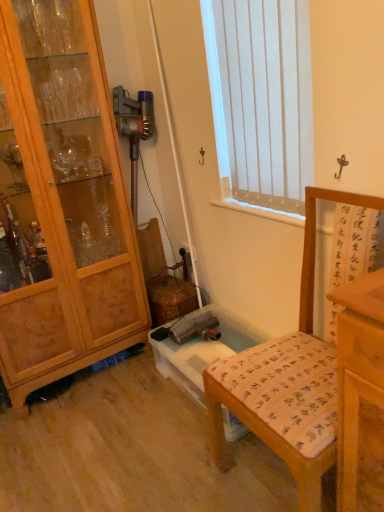
The image size is (384, 512). What do you see at coordinates (287, 382) in the screenshot?
I see `wooden chair with printed cushion at lower right` at bounding box center [287, 382].

Describe the element at coordinates (262, 100) in the screenshot. Image resolution: width=384 pixels, height=512 pixels. I see `white vertical blinds at upper center` at that location.

Find the location of `wooden chair with printed cushion at lower right`. wooden chair with printed cushion at lower right is located at coordinates click(x=287, y=382).

From the image's perspective, which one is positioned lower, wooden chair with printed cushion at lower right or wooden cabinet at left?

wooden chair with printed cushion at lower right appears lower in the image.

Between wooden chair with printed cushion at lower right and wooden cabinet at left, which one has larger size?

Bigger between the two is wooden cabinet at left.

Is wooden chair with printed cushion at lower right looking in the opposite direction of wooden cabinet at left?

wooden chair with printed cushion at lower right is not turned away from wooden cabinet at left.

Find the location of a particular element. This screenshot has height=512, width=384. cabinetry above the wooden chair with printed cushion at lower right (from a real-world perspective) is located at coordinates (64, 198).

Which object is more forward, white vertical blinds at upper center or wooden cabinet at left?

white vertical blinds at upper center is more forward.

Is white vertical blinds at upper center not within wooden cabinet at left?

Yes.

From a real-world perspective, relative to wooden cabinet at left, is white vertical blinds at upper center vertically above or below?

From a real-world perspective, white vertical blinds at upper center is physically above wooden cabinet at left.

Is white vertical blinds at upper center with wooden cabinet at left?

No, white vertical blinds at upper center is not in contact with wooden cabinet at left.

Is wooden cabinet at left wider or thinner than white vertical blinds at upper center?

Considering their sizes, wooden cabinet at left looks broader than white vertical blinds at upper center.

Who is bigger, wooden cabinet at left or white vertical blinds at upper center?

With larger size is wooden cabinet at left.

From a real-world perspective, is wooden cabinet at left located higher than white vertical blinds at upper center?

No, from a real-world perspective, wooden cabinet at left is not over white vertical blinds at upper center

Which object is more forward, wooden cabinet at left or white vertical blinds at upper center?

Positioned in front is white vertical blinds at upper center.

Which is more to the right, wooden chair with printed cushion at lower right or white vertical blinds at upper center?

From the viewer's perspective, wooden chair with printed cushion at lower right appears more on the right side.

From the image's perspective, which object appears higher, wooden chair with printed cushion at lower right or white vertical blinds at upper center?

white vertical blinds at upper center, from the image's perspective.

Considering the sizes of objects wooden chair with printed cushion at lower right and white vertical blinds at upper center in the image provided, who is shorter, wooden chair with printed cushion at lower right or white vertical blinds at upper center?

With less height is white vertical blinds at upper center.

Which of these two, wooden cabinet at left or wooden chair with printed cushion at lower right, stands taller?

Standing taller between the two is wooden cabinet at left.

Considering the relative positions of wooden cabinet at left and wooden chair with printed cushion at lower right in the image provided, is wooden cabinet at left in front of wooden chair with printed cushion at lower right?

No, it is behind wooden chair with printed cushion at lower right.

Which is closer to the camera, (67, 184) or (285, 434)?

The point (285, 434) is in front.

Where is `cabinetry above the wooden chair with printed cushion at lower right (from the image's perspective)`? cabinetry above the wooden chair with printed cushion at lower right (from the image's perspective) is located at coordinates (64, 198).

Considering the relative positions of white vertical blinds at upper center and wooden chair with printed cushion at lower right in the image provided, is white vertical blinds at upper center to the left or to the right of wooden chair with printed cushion at lower right?

Clearly, white vertical blinds at upper center is on the left of wooden chair with printed cushion at lower right in the image.

Would you say white vertical blinds at upper center contains wooden chair with printed cushion at lower right?

No, wooden chair with printed cushion at lower right is located outside of white vertical blinds at upper center.

Can you confirm if white vertical blinds at upper center is shorter than wooden chair with printed cushion at lower right?

Yes, white vertical blinds at upper center is shorter than wooden chair with printed cushion at lower right.

Is white vertical blinds at upper center turned away from wooden chair with printed cushion at lower right?

white vertical blinds at upper center is not turned away from wooden chair with printed cushion at lower right.

The height and width of the screenshot is (512, 384). What are the coordinates of `chair that is in front of the wooden cabinet at left` in the screenshot? It's located at (287, 382).

Find the location of a particular element. This screenshot has height=512, width=384. window above the wooden cabinet at left (from the image's perspective) is located at coordinates (262, 100).

Based on their spatial positions, is wooden cabinet at left or wooden chair with printed cushion at lower right closer to white vertical blinds at upper center?

wooden cabinet at left.

Based on their spatial positions, is wooden chair with printed cushion at lower right or wooden cabinet at left closer to white vertical blinds at upper center?

wooden cabinet at left.

Looking at the image, which one is located further to wooden chair with printed cushion at lower right, white vertical blinds at upper center or wooden cabinet at left?

Among the two, wooden cabinet at left is located further to wooden chair with printed cushion at lower right.

Which object lies further to the anchor point wooden chair with printed cushion at lower right, wooden cabinet at left or white vertical blinds at upper center?

wooden cabinet at left lies further to wooden chair with printed cushion at lower right than the other object.

Which object lies nearer to the anchor point wooden cabinet at left, white vertical blinds at upper center or wooden chair with printed cushion at lower right?

white vertical blinds at upper center.

From the picture: Based on their spatial positions, is wooden chair with printed cushion at lower right or white vertical blinds at upper center closer to wooden cabinet at left?

The object closer to wooden cabinet at left is white vertical blinds at upper center.

This screenshot has width=384, height=512. I want to click on window between wooden cabinet at left and wooden chair with printed cushion at lower right from left to right, so tap(262, 100).